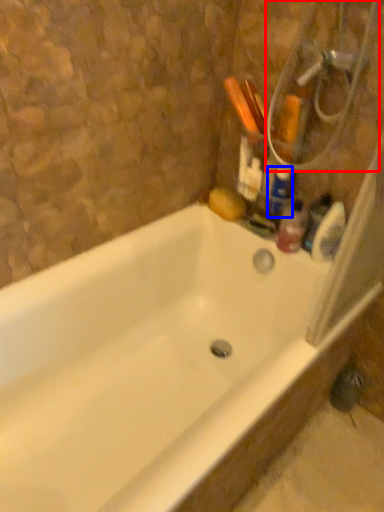
Question: Among these objects, which one is farthest to the camera, shower (highlighted by a red box) or cleaning product (highlighted by a blue box)?

Choices:
 (A) shower
 (B) cleaning product

Answer: (B)